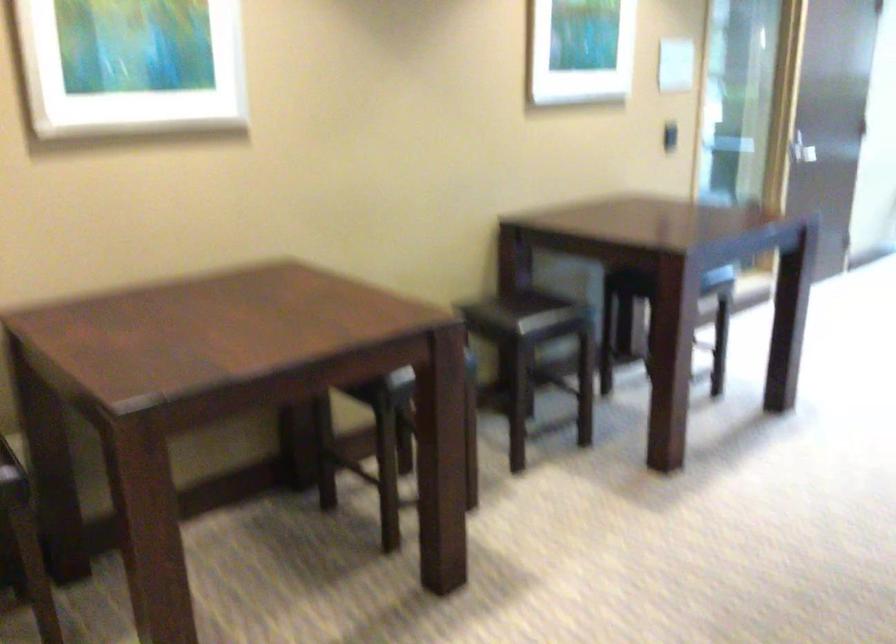
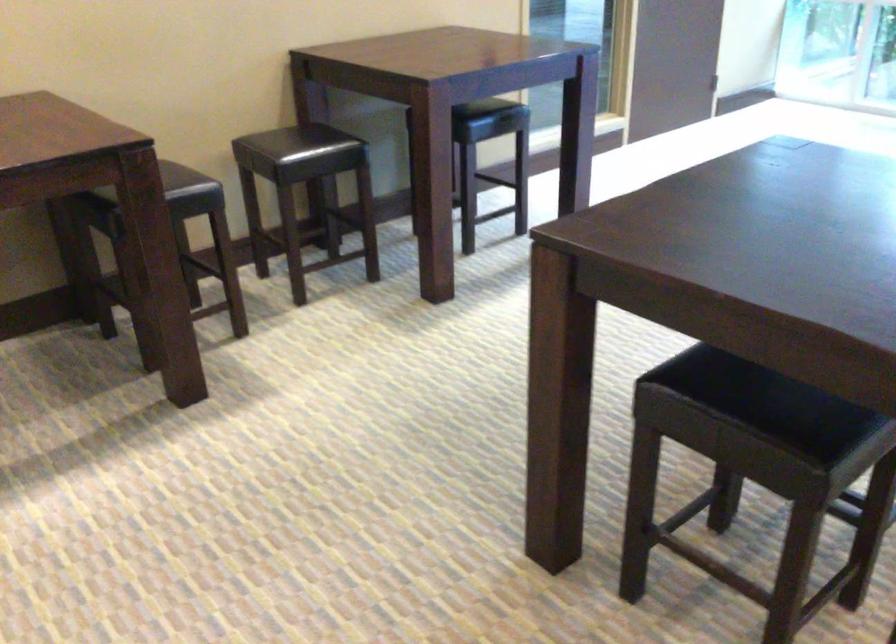
Question: The images are taken continuously from a first-person perspective. In which direction is your viewpoint rotating?

Choices:
 (A) Left
 (B) Right
 (C) Up
 (D) Down

Answer: (D)